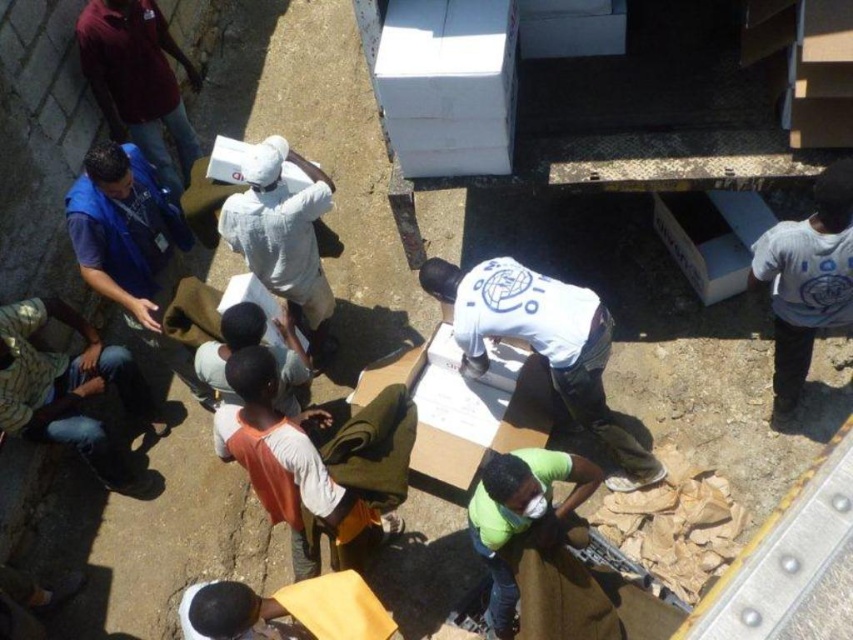
You are a delivery person who just arrived at the construction site. You see the cardboard box at center and the green matte shirt at lower center. Which object is located more to the left?

The cardboard box at center is positioned on the left side of green matte shirt at lower center, so it is more to the left.

You are a safety inspector checking the visibility of clothing in the scene. The blue fabric vest at upper left and the blue fabric shirt at upper left are both worn by workers. Which clothing item has a narrower width when viewed from your perspective?

The blue fabric vest at upper left is thinner than the blue fabric shirt at upper left, so the blue fabric vest at upper left has a narrower width.